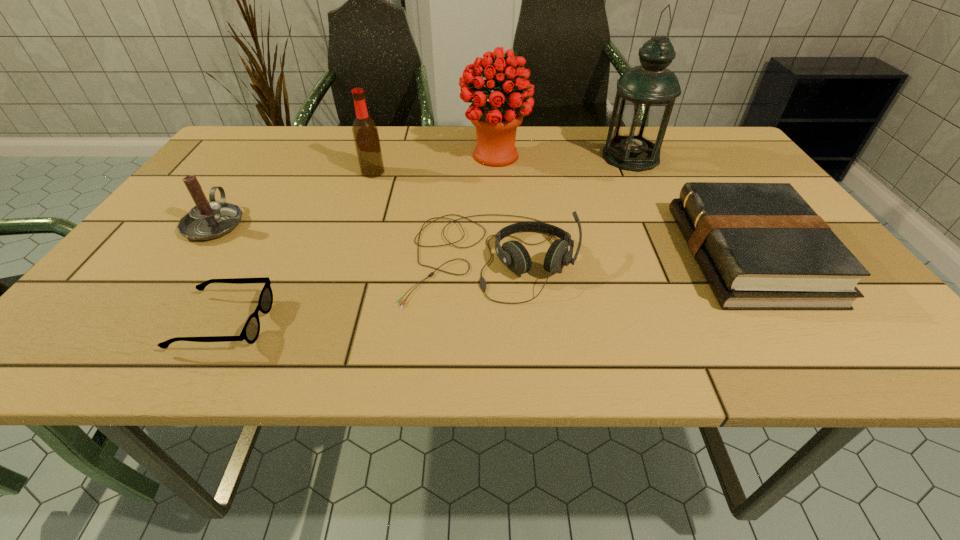
You are a GUI agent. You are given a task and a screenshot of the screen. Output one action in this format:
    pyautogui.click(x=<x>, y=<y>)
    Task: Click on the vacant space that's between the headset and the bouquet
    The width and height of the screenshot is (960, 540).
    Given the screenshot: What is the action you would take?
    pyautogui.click(x=492, y=207)

You are a GUI agent. You are given a task and a screenshot of the screen. Output one action in this format:
    pyautogui.click(x=<x>, y=<y>)
    Task: Click on the vacant area that lies between the tallest object and the second tallest object
    
    Given the screenshot: What is the action you would take?
    pyautogui.click(x=563, y=157)

Select which object is the third closest to the oil lamp. Please provide its 2D coordinates. Your answer should be formatted as a tuple, i.e. [(x, y)], where the tuple contains the x and y coordinates of a point satisfying the conditions above.

[(513, 254)]

Identify the location of object that stands as the second closest to the sixth object from right to left. The width and height of the screenshot is (960, 540). (513, 254).

The width and height of the screenshot is (960, 540). Identify the location of vacant position in the image that satisfies the following two spatial constraints: 1. on the side of the oil lamp with the handle loop; 2. on the left side of the leftmost object. (262, 157).

Find the location of a particular element. This screenshot has width=960, height=540. free point that satisfies the following two spatial constraints: 1. on the front side of the fifth shortest object; 2. on the arms of the shortest object is located at coordinates (323, 323).

What are the coordinates of `free location that satisfies the following two spatial constraints: 1. on the outer surface of the headset; 2. on the arms of the shortest object` in the screenshot? It's located at (492, 323).

At what (x,y) coordinates should I click in order to perform the action: click on free point that satisfies the following two spatial constraints: 1. on the front side of the beer bottle; 2. on the arms of the spectacles. Please return your answer as a coordinate pair (x, y). Image resolution: width=960 pixels, height=540 pixels. Looking at the image, I should click on [x=323, y=323].